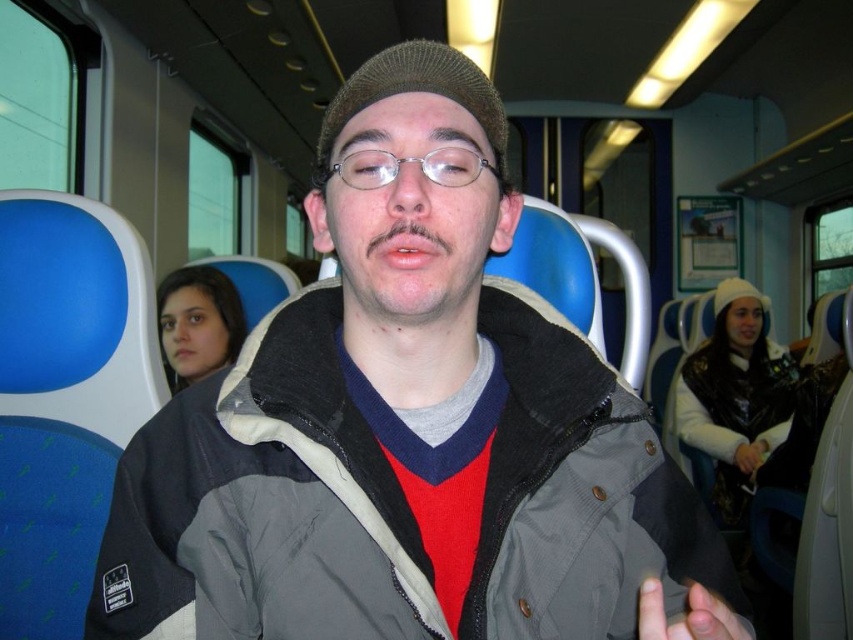
Measure the distance from matte gray jacket at center to smooth skin hand at center.

matte gray jacket at center and smooth skin hand at center are 2.15 meters apart.

Is point (410, 436) positioned after point (735, 467)?

That is False.

This screenshot has width=853, height=640. What do you see at coordinates (403, 429) in the screenshot? I see `matte gray jacket at center` at bounding box center [403, 429].

Identify the location of matte gray jacket at center. 403,429.

Is clear plastic glasses at center further to camera compared to smooth skin hand at center?

No, clear plastic glasses at center is closer to the viewer.

Which is behind, point (467, 152) or point (752, 445)?

The point (752, 445) is behind.

You are a GUI agent. You are given a task and a screenshot of the screen. Output one action in this format:
    pyautogui.click(x=<x>, y=<y>)
    Task: Click on the clear plastic glasses at center
    This screenshot has height=640, width=853.
    Given the screenshot: What is the action you would take?
    pyautogui.click(x=408, y=163)

Does smooth skin hand at lower right appear on the right side of smooth skin hand at center?

In fact, smooth skin hand at lower right is to the left of smooth skin hand at center.

Locate an element on the screen. Image resolution: width=853 pixels, height=640 pixels. smooth skin hand at lower right is located at coordinates (688, 616).